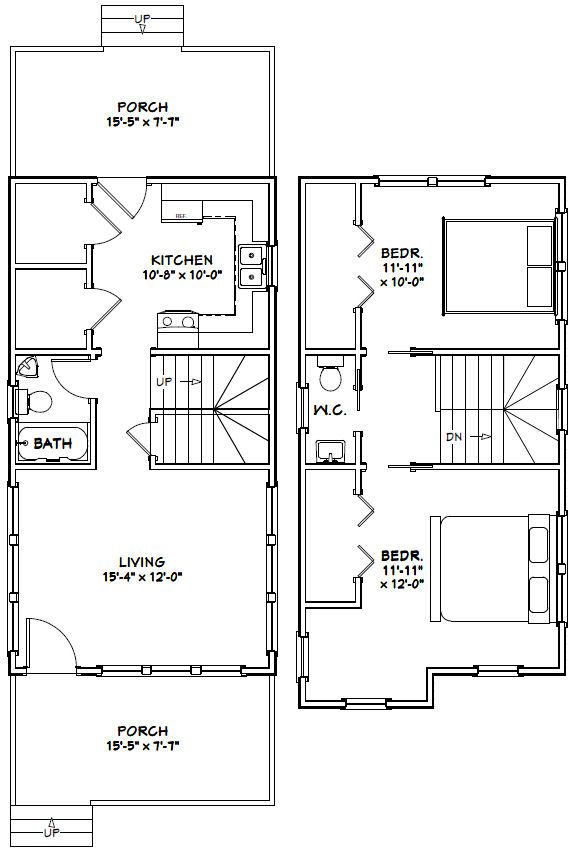
The width and height of the screenshot is (575, 856). Identify the location of windows on upper level. (500, 663), (375, 709), (301, 656), (302, 413), (410, 171), (555, 242), (563, 554), (559, 406).